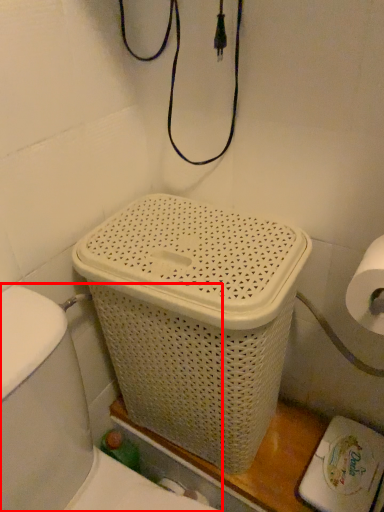
Question: From the image's perspective, considering the relative positions of sink (annotated by the red box) and basket container in the image provided, where is sink (annotated by the red box) located with respect to the staircase?

Choices:
 (A) below
 (B) above

Answer: (A)